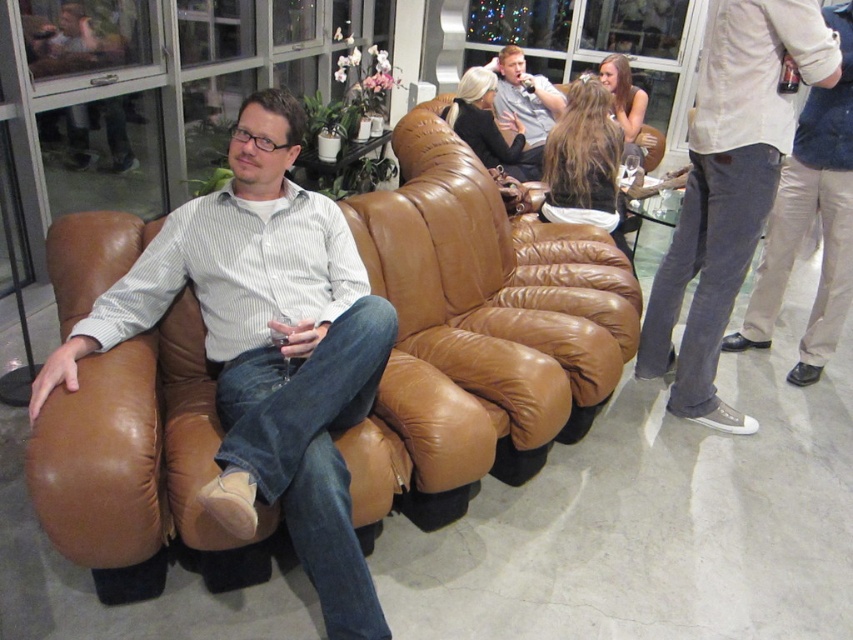
Question: Estimate the real-world distances between objects in this image. Which object is farther from the matte gray shirt at upper center?

Choices:
 (A) light gray jeans at right
 (B) matte brown leather couch at left

Answer: (B)

Question: In this image, where is matte brown leather couch at left located relative to light beige pants at right?

Choices:
 (A) left
 (B) right

Answer: (A)

Question: Considering the real-world distances, which object is farthest from the light gray jeans at right?

Choices:
 (A) matte gray shirt at upper center
 (B) light beige pants at right

Answer: (A)

Question: Does light gray jeans at right appear on the left side of light beige pants at right?

Choices:
 (A) yes
 (B) no

Answer: (A)

Question: Considering the relative positions of light gray jeans at right and matte gray shirt at upper center in the image provided, where is light gray jeans at right located with respect to matte gray shirt at upper center?

Choices:
 (A) below
 (B) above

Answer: (A)

Question: Which object is positioned closest to the light beige pants at right?

Choices:
 (A) light gray jeans at right
 (B) matte gray shirt at upper center
 (C) matte brown leather couch at left

Answer: (A)